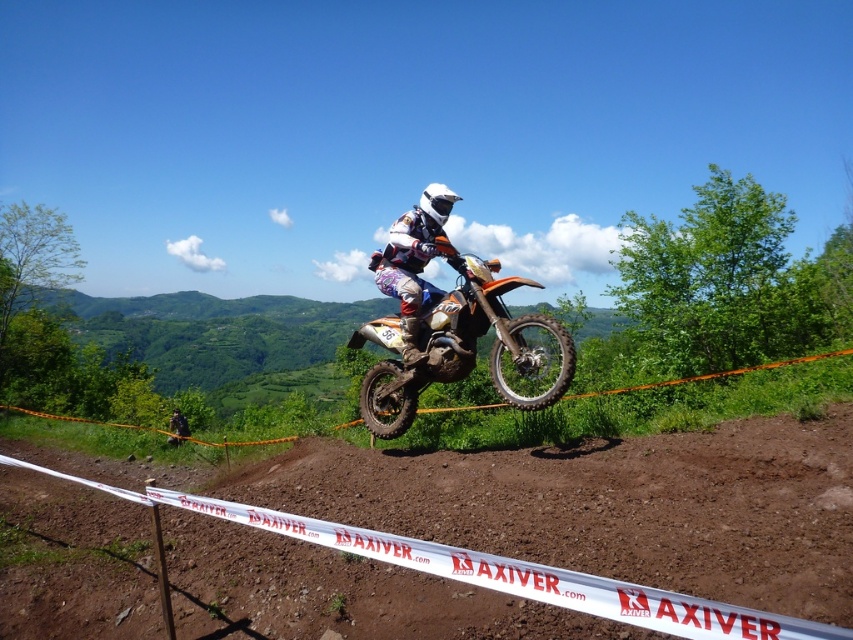
Which of these two, brown dirt field at center or white matte helmet at center, stands shorter?

brown dirt field at center is shorter.

What do you see at coordinates (611, 506) in the screenshot?
I see `brown dirt field at center` at bounding box center [611, 506].

What are the coordinates of `brown dirt field at center` in the screenshot? It's located at (611, 506).

Which is behind, point (606, 483) or point (427, 339)?

Point (427, 339)

Can you confirm if brown dirt field at center is smaller than orange matte dirt bike at center?

Yes.

What do you see at coordinates (611, 506) in the screenshot?
I see `brown dirt field at center` at bounding box center [611, 506].

Where is `brown dirt field at center`? The image size is (853, 640). brown dirt field at center is located at coordinates (611, 506).

Which is below, orange matte dirt bike at center or white matte helmet at center?

orange matte dirt bike at center is lower down.

Which is more to the right, orange matte dirt bike at center or white matte helmet at center?

orange matte dirt bike at center

Does point (497, 282) come behind point (405, 240)?

No.

This screenshot has width=853, height=640. In order to click on orange matte dirt bike at center in this screenshot , I will do `click(473, 349)`.